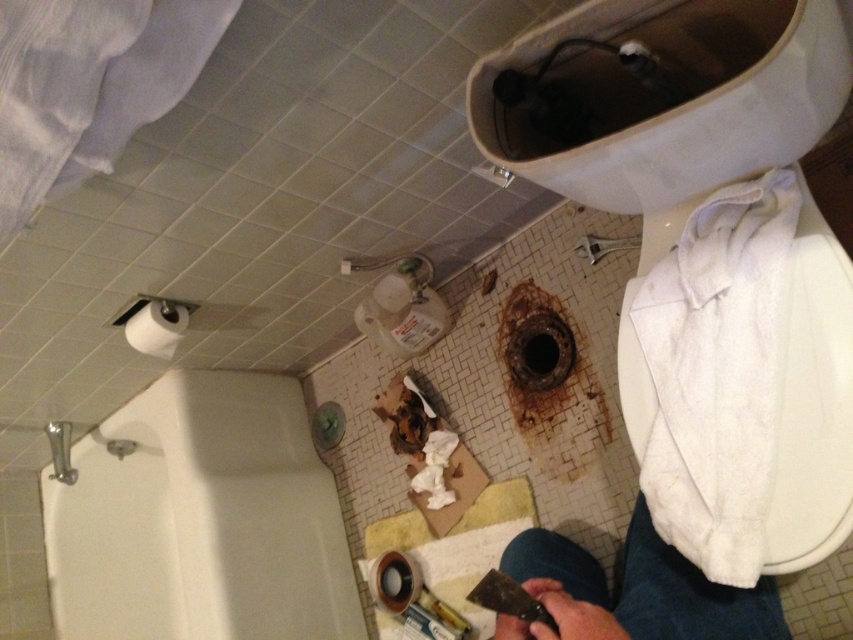
Question: Which point appears farthest from the camera in this image?

Choices:
 (A) (688, 621)
 (B) (184, 316)
 (C) (672, 268)
 (D) (247, 490)

Answer: (D)

Question: Estimate the real-world distances between objects in this image. Which object is closer to the jeans at lower right?

Choices:
 (A) white matte towel at right
 (B) white glossy bathtub at lower left
 (C) white matte toilet paper at upper left

Answer: (A)

Question: Considering the relative positions of white glossy bathtub at lower left and jeans at lower right in the image provided, where is white glossy bathtub at lower left located with respect to jeans at lower right?

Choices:
 (A) left
 (B) right

Answer: (A)

Question: Which point is farther to the camera?

Choices:
 (A) (671, 563)
 (B) (724, 289)
 (C) (152, 317)
 (D) (56, 586)

Answer: (D)

Question: Can you confirm if jeans at lower right is wider than white matte toilet paper at upper left?

Choices:
 (A) no
 (B) yes

Answer: (B)

Question: Is white matte towel at right smaller than white matte toilet paper at upper left?

Choices:
 (A) yes
 (B) no

Answer: (B)